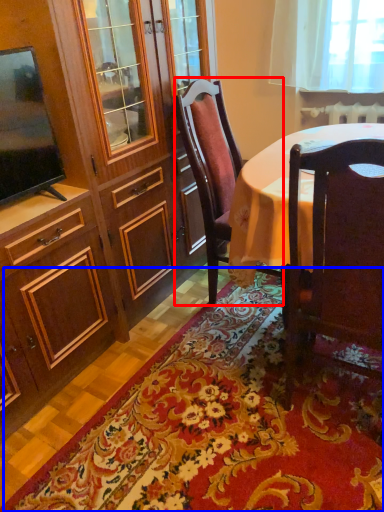
Question: Which of the following is the farthest to the observer, chair (highlighted by a red box) or mat (highlighted by a blue box)?

Choices:
 (A) chair
 (B) mat

Answer: (A)